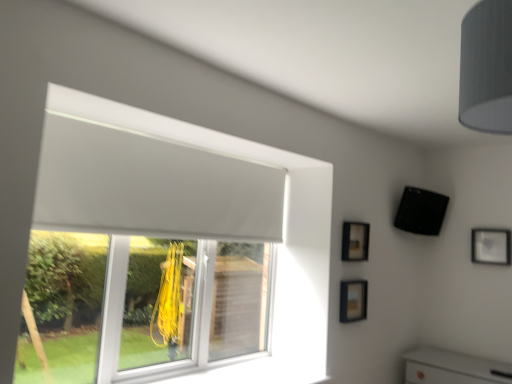
Question: Would you say white matte window at upper left is inside or outside gray fabric lampshade at upper right?

Choices:
 (A) outside
 (B) inside

Answer: (A)

Question: Considering the positions of point 71,365 and point 503,109, is point 71,365 closer or farther from the camera than point 503,109?

Choices:
 (A) farther
 (B) closer

Answer: (A)

Question: Which of these objects is positioned farthest from the gray fabric lampshade at upper right?

Choices:
 (A) black matte speaker at upper right
 (B) white matte window at upper left
 (C) matte black picture frame at lower center, marked as the third picture frame in a back-to-front arrangement
 (D) matte black picture frame at upper right, positioned as the third picture frame in front-to-back order
 (E) matte black picture frame at upper right, which ranks as the 2th picture frame in right-to-left order

Answer: (D)

Question: Which object is positioned farthest from the gray fabric lampshade at upper right?

Choices:
 (A) black matte speaker at upper right
 (B) matte black picture frame at upper right, which ranks as the 2th picture frame in right-to-left order
 (C) matte black picture frame at upper right, positioned as the 1th picture frame in right-to-left order
 (D) white matte window at upper left
 (E) matte black picture frame at lower center, which ranks as the 1th picture frame in front-to-back order

Answer: (C)